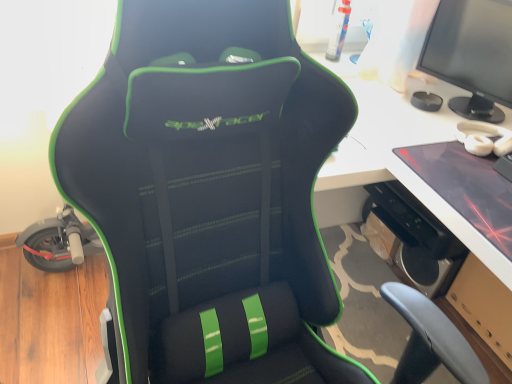
What are the coordinates of `vacant space underneath matte black laptop at right (from a real-world perspective)` in the screenshot? It's located at (473, 180).